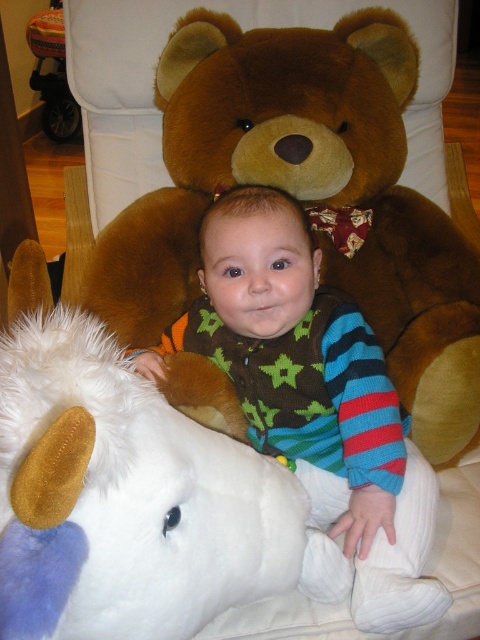
Question: Is brown plush teddy bear at center bigger than multicolored knit sweater at center?

Choices:
 (A) no
 (B) yes

Answer: (B)

Question: In this image, where is brown plush teddy bear at center located relative to multicolored knit sweater at center?

Choices:
 (A) below
 (B) above

Answer: (B)

Question: Which object appears closest to the camera in this image?

Choices:
 (A) multicolored knit sweater at center
 (B) brown plush teddy bear at center

Answer: (A)

Question: Which point is closer to the camera?

Choices:
 (A) click(216, 557)
 (B) click(309, 301)

Answer: (A)

Question: Among these objects, which one is nearest to the camera?

Choices:
 (A) white plush unicorn at lower left
 (B) brown plush teddy bear at center

Answer: (A)

Question: Where is white plush unicorn at lower left located in relation to multicolored knit sweater at center in the image?

Choices:
 (A) right
 (B) left

Answer: (B)